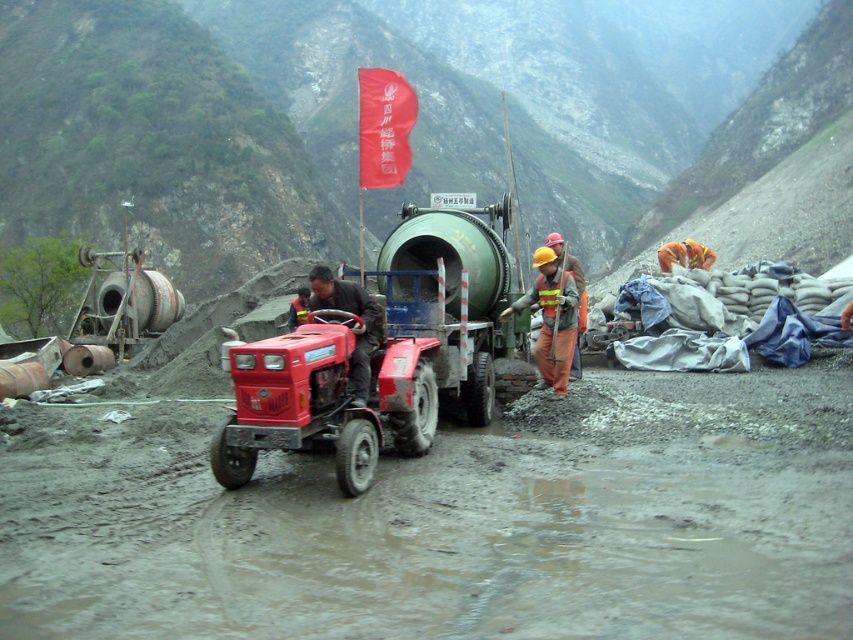
Consider the image. You are a construction worker on the site and need to locate your orange reflective vest at center. You see the red matte tractor at center in front of you. Which direction should you move to find your vest?

The orange reflective vest at center is to the right of the red matte tractor at center, so you should move to your right to find it.

You are a safety inspector at the construction site and need to check the distance between the red matte tractor at center and the orange reflective vest at center. Based on the scene, which object is nearer to you?

The red matte tractor at center is closer to the viewer than the orange reflective vest at center.

You are a drone operator tasked with capturing aerial footage of the construction site. The drone is currently at a position above the red matte tractor at center. To ensure safety, you need to move the drone to a point that is 0.1 units higher in the y coordinate and 0.05 units to the right in the x coordinate from the tractor. What will be the new coordinates of the drone after this adjustment?

The new coordinates will be x 0.608 and y 0.551, calculated by adding 0.05 to the original x coordinate of 0.558 and adding 0.1 to the original y coordinate of 0.451.